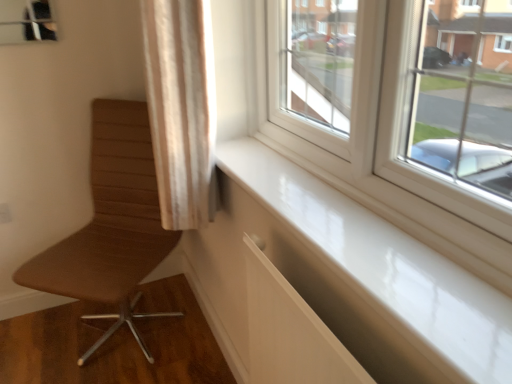
Describe the element at coordinates (375, 279) in the screenshot. I see `white glossy window sill at lower right` at that location.

Describe the element at coordinates (111, 225) in the screenshot. This screenshot has height=384, width=512. I see `brown leather chair at left` at that location.

At what (x,y) coordinates should I click in order to perform the action: click on beige fabric curtain at upper left. Please return your answer as a coordinate pair (x, y). Image resolution: width=512 pixels, height=384 pixels. Looking at the image, I should click on (181, 107).

Considering the positions of objects white glossy window sill at lower right and brown leather chair at left in the image provided, who is in front, white glossy window sill at lower right or brown leather chair at left?

white glossy window sill at lower right is closer to the camera.

Between white glossy window sill at lower right and brown leather chair at left, which one has more height?

Standing taller between the two is brown leather chair at left.

Could you tell me if white glossy window sill at lower right is facing brown leather chair at left?

No, white glossy window sill at lower right is not turned towards brown leather chair at left.

Is brown leather chair at left not within beige fabric curtain at upper left?

brown leather chair at left is positioned outside beige fabric curtain at upper left.

Does point (106, 154) come behind point (170, 56)?

Yes, point (106, 154) is behind point (170, 56).

Is brown leather chair at left aimed at beige fabric curtain at upper left?

No, brown leather chair at left is not aimed at beige fabric curtain at upper left.

From the image's perspective, which one is positioned higher, brown leather chair at left or beige fabric curtain at upper left?

beige fabric curtain at upper left, from the image's perspective.

Is beige fabric curtain at upper left in front of or behind white glossy window sill at lower right in the image?

Clearly, beige fabric curtain at upper left is behind white glossy window sill at lower right.

From the image's perspective, does beige fabric curtain at upper left appear higher than white glossy window sill at lower right?

Indeed, from the image's perspective, beige fabric curtain at upper left is shown above white glossy window sill at lower right.

Does point (206, 207) come behind point (294, 188)?

Yes.

This screenshot has width=512, height=384. What are the coordinates of `curtain that appears on the left of white glossy window sill at lower right` in the screenshot? It's located at (181, 107).

From the image's perspective, between beige fabric curtain at upper left and brown leather chair at left, who is located below?

From the image's view, brown leather chair at left is below.

Looking at this image, from a real-world perspective, is beige fabric curtain at upper left above or below brown leather chair at left?

In terms of real-world spatial position, beige fabric curtain at upper left is above brown leather chair at left.

Would you say beige fabric curtain at upper left is outside brown leather chair at left?

That's correct, beige fabric curtain at upper left is outside of brown leather chair at left.

From the picture: Between beige fabric curtain at upper left and brown leather chair at left, which one has larger size?

brown leather chair at left.

Is brown leather chair at left not within white glossy window sill at lower right?

Absolutely, brown leather chair at left is external to white glossy window sill at lower right.

From the picture: From the image's perspective, is brown leather chair at left located beneath white glossy window sill at lower right?

Yes, from the image's perspective, brown leather chair at left is beneath white glossy window sill at lower right.

Is brown leather chair at left wider than white glossy window sill at lower right?

Indeed, brown leather chair at left has a greater width compared to white glossy window sill at lower right.

Which object is closer to the camera, brown leather chair at left or white glossy window sill at lower right?

white glossy window sill at lower right is in front.

Does white glossy window sill at lower right have a larger size compared to beige fabric curtain at upper left?

Incorrect, white glossy window sill at lower right is not larger than beige fabric curtain at upper left.

Is white glossy window sill at lower right situated inside beige fabric curtain at upper left or outside?

white glossy window sill at lower right is not inside beige fabric curtain at upper left, it's outside.

From the image's perspective, is white glossy window sill at lower right located above beige fabric curtain at upper left?

No, from the image's perspective, white glossy window sill at lower right is not above beige fabric curtain at upper left.

Is white glossy window sill at lower right in contact with beige fabric curtain at upper left?

No, white glossy window sill at lower right is not making contact with beige fabric curtain at upper left.

Locate an element on the screen. chair below the white glossy window sill at lower right (from the image's perspective) is located at coordinates (111, 225).

I want to click on curtain on the right of brown leather chair at left, so click(181, 107).

Considering their positions, is white glossy window sill at lower right positioned closer to brown leather chair at left than beige fabric curtain at upper left?

beige fabric curtain at upper left lies closer to brown leather chair at left than the other object.

Which object lies further to the anchor point white glossy window sill at lower right, brown leather chair at left or beige fabric curtain at upper left?

brown leather chair at left is further to white glossy window sill at lower right.

From the image, which object appears to be nearer to beige fabric curtain at upper left, brown leather chair at left or white glossy window sill at lower right?

white glossy window sill at lower right.

From the image, which object appears to be farther from beige fabric curtain at upper left, white glossy window sill at lower right or brown leather chair at left?

Among the two, brown leather chair at left is located further to beige fabric curtain at upper left.

When comparing their distances from brown leather chair at left, does beige fabric curtain at upper left or white glossy window sill at lower right seem closer?

Based on the image, beige fabric curtain at upper left appears to be nearer to brown leather chair at left.

When comparing their distances from white glossy window sill at lower right, does beige fabric curtain at upper left or brown leather chair at left seem closer?

Based on the image, beige fabric curtain at upper left appears to be nearer to white glossy window sill at lower right.

Image resolution: width=512 pixels, height=384 pixels. What are the coordinates of `curtain between brown leather chair at left and white glossy window sill at lower right in the horizontal direction` in the screenshot? It's located at (181, 107).